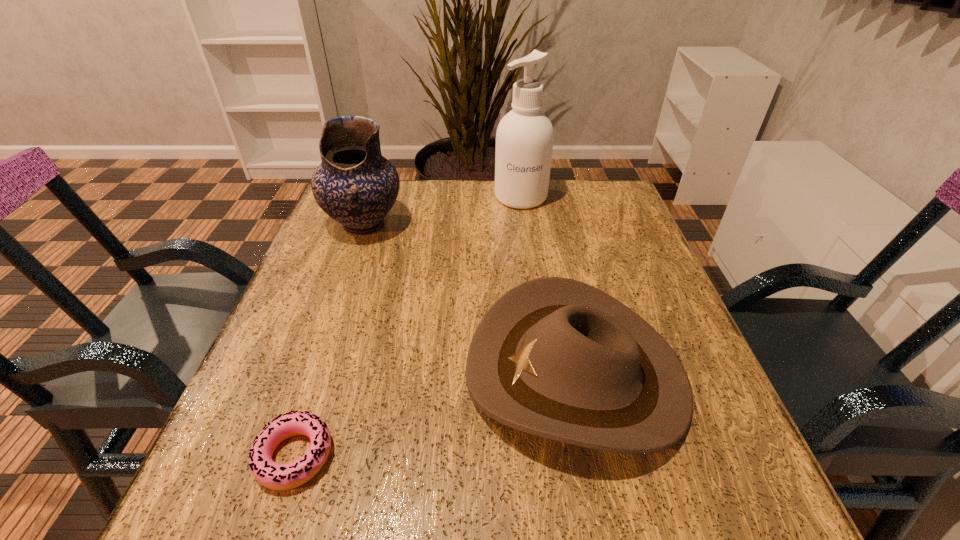
Where is `cleansing agent positioned at the far edge`? cleansing agent positioned at the far edge is located at coordinates (524, 139).

Find the location of a particular element. This screenshot has height=540, width=960. pottery situated at the far edge is located at coordinates (355, 185).

At what (x,y) coordinates should I click in order to perform the action: click on cowboy hat that is at the near edge. Please return your answer as a coordinate pair (x, y). Image resolution: width=960 pixels, height=540 pixels. Looking at the image, I should click on (553, 357).

This screenshot has height=540, width=960. I want to click on doughnut that is at the near edge, so click(x=270, y=474).

I want to click on pottery located at the left edge, so click(355, 185).

The width and height of the screenshot is (960, 540). I want to click on doughnut present at the left edge, so click(x=270, y=474).

At what (x,y) coordinates should I click in order to perform the action: click on object that is at the right edge. Please return your answer as a coordinate pair (x, y). This screenshot has width=960, height=540. Looking at the image, I should click on (553, 357).

Where is `object located at the far left corner`? This screenshot has height=540, width=960. object located at the far left corner is located at coordinates (355, 185).

Locate an element on the screen. The height and width of the screenshot is (540, 960). object that is at the near left corner is located at coordinates (270, 474).

This screenshot has width=960, height=540. Find the location of `object located at the near right corner`. object located at the near right corner is located at coordinates (553, 357).